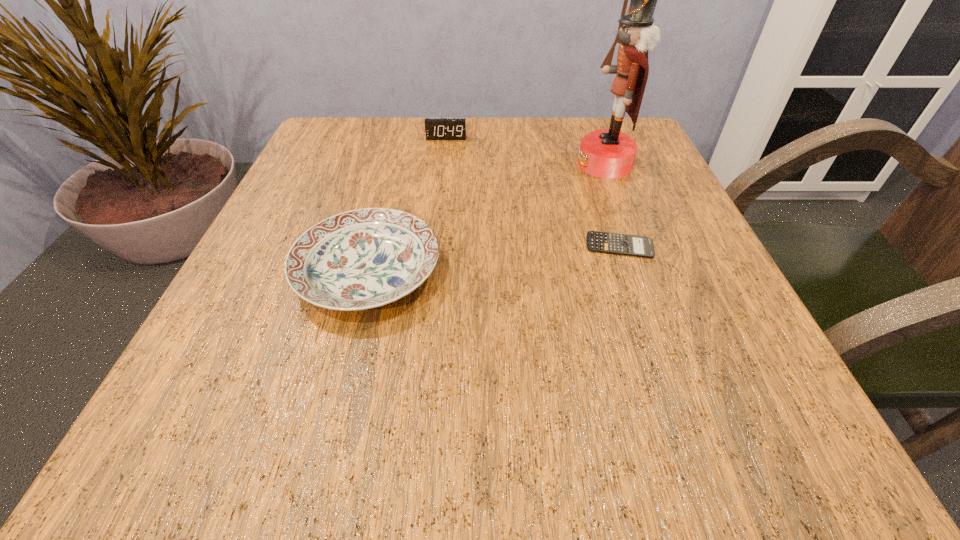
Identify the location of the tallest object. (606, 153).

At what (x,y) coordinates should I click in order to perform the action: click on the second farthest object. Please return your answer as a coordinate pair (x, y). The height and width of the screenshot is (540, 960). Looking at the image, I should click on (606, 153).

Locate an element on the screen. This screenshot has width=960, height=540. the farthest object is located at coordinates (435, 128).

You are a GUI agent. You are given a task and a screenshot of the screen. Output one action in this format:
    pyautogui.click(x=<x>, y=<y>)
    Task: Click on the plate
    The image size is (960, 540).
    Given the screenshot: What is the action you would take?
    pos(365,258)

What are the coordinates of `calculator` in the screenshot? It's located at (605, 242).

The image size is (960, 540). I want to click on blank space located 0.220m on the front-facing side of the third nearest object, so click(x=473, y=164).

You are a GUI agent. You are given a task and a screenshot of the screen. Output one action in this format:
    pyautogui.click(x=<x>, y=<y>)
    Task: Click on the vacant space located on the front-facing side of the third nearest object
    
    Given the screenshot: What is the action you would take?
    pyautogui.click(x=387, y=164)

Find the location of a particular element. This screenshot has height=540, width=960. blank space located 0.250m on the front-facing side of the third nearest object is located at coordinates (459, 164).

This screenshot has height=540, width=960. Find the location of `vacant region located 0.070m on the front-facing side of the alarm clock`. vacant region located 0.070m on the front-facing side of the alarm clock is located at coordinates (444, 156).

Identify the location of free region located 0.260m on the right of the second shortest object. (605, 272).